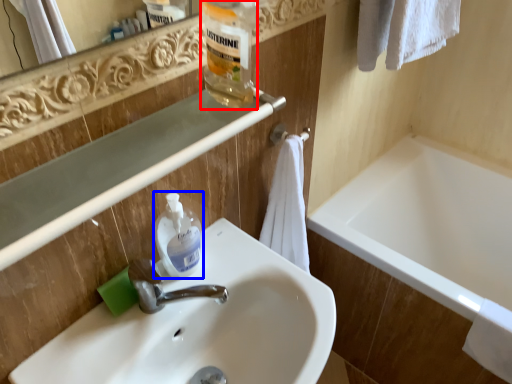
Question: Which object is further to the camera taking this photo, bottle (highlighted by a red box) or cleaning product (highlighted by a blue box)?

Choices:
 (A) bottle
 (B) cleaning product

Answer: (B)